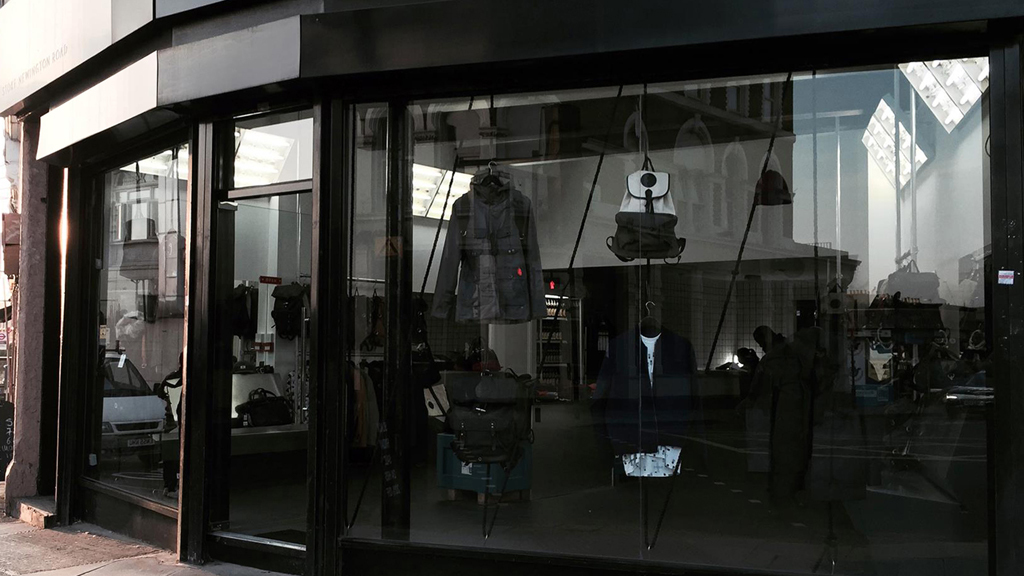
Where is `window`? window is located at coordinates (527, 261).